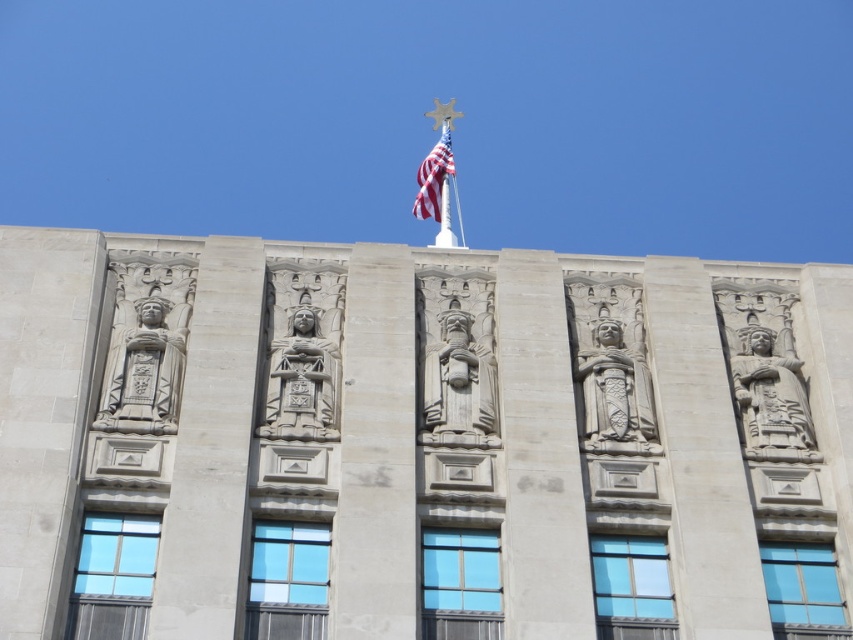
Can you confirm if gray stone statue at center left is wider than american flag at top?

No, gray stone statue at center left is not wider than american flag at top.

Who is lower down, gray stone statue at center left or american flag at top?

gray stone statue at center left

Where is `gray stone statue at center left`? The height and width of the screenshot is (640, 853). gray stone statue at center left is located at coordinates (143, 365).

Who is lower down, carved stone king at center or gray stone statue at center left?

gray stone statue at center left is below.

Is point (485, 316) more distant than point (115, 385)?

Yes, it is.

Locate an element on the screen. The height and width of the screenshot is (640, 853). carved stone king at center is located at coordinates (457, 365).

Is carved stone king at center below polished stone statue at center?

Yes, carved stone king at center is below polished stone statue at center.

Who is shorter, carved stone king at center or polished stone statue at center?

With less height is polished stone statue at center.

Find the location of a particular element. This screenshot has width=853, height=640. carved stone king at center is located at coordinates 457,365.

This screenshot has height=640, width=853. Find the location of `carved stone king at center`. carved stone king at center is located at coordinates (457, 365).